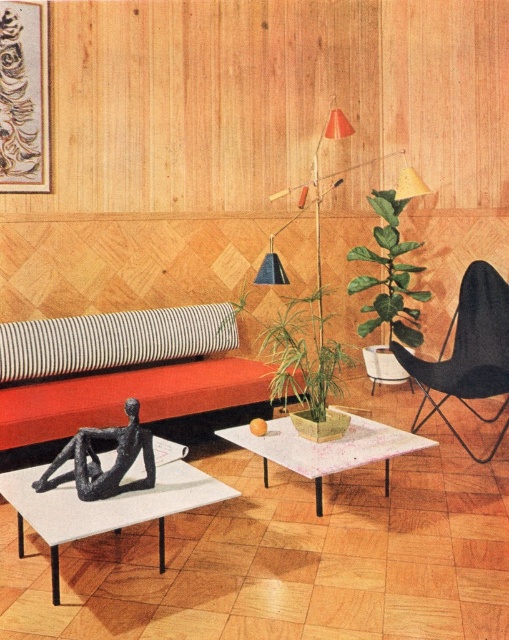
Question: Does white striped cushion at center have a lesser width compared to speckled white table at center?

Choices:
 (A) no
 (B) yes

Answer: (A)

Question: Which is farther from the metallic/textured floor lamp at center?

Choices:
 (A) metallic gray table at center
 (B) green leafy plant at center
 (C) green leafy plant at upper right
 (D) black matte armchair at right

Answer: (A)

Question: Which point is farther to the camera?

Choices:
 (A) (321, 326)
 (B) (491, 276)
 (C) (48, 358)
 (D) (319, 381)

Answer: (B)

Question: Among these objects, which one is farthest from the camera?

Choices:
 (A) green leafy plant at center
 (B) white striped cushion at center

Answer: (B)

Question: Does matte orange couch at center appear on the right side of black matte sculpture at lower left?

Choices:
 (A) yes
 (B) no

Answer: (B)

Question: Where is green leafy plant at center located in relation to green leafy plant at upper right in the image?

Choices:
 (A) right
 (B) left

Answer: (B)